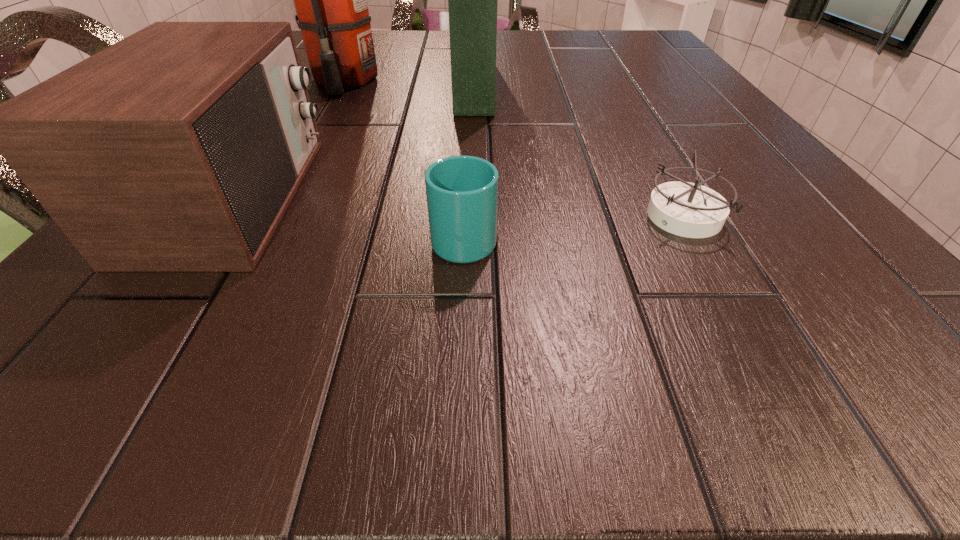
Where is `vacant point that satisfies the following two spatial constraints: 1. on the nozzle of the compass; 2. on the right side of the fire extinguisher`? The width and height of the screenshot is (960, 540). vacant point that satisfies the following two spatial constraints: 1. on the nozzle of the compass; 2. on the right side of the fire extinguisher is located at coordinates (263, 217).

This screenshot has width=960, height=540. I want to click on vacant position in the image that satisfies the following two spatial constraints: 1. on the handle side of the fourth tallest object; 2. on the front-facing side of the radio receiver, so click(466, 198).

Identify the location of vacant space that satisfies the following two spatial constraints: 1. on the back side of the compass; 2. on the front-facing side of the first-aid kit. (612, 85).

The height and width of the screenshot is (540, 960). I want to click on free location that satisfies the following two spatial constraints: 1. on the nozzle of the tallest object; 2. on the front-facing side of the radio receiver, so click(275, 198).

In order to click on free space that satisfies the following two spatial constraints: 1. on the front-facing side of the radio receiver; 2. on the handle side of the cup in this screenshot , I will do `click(207, 238)`.

Locate an element on the screen. Image resolution: width=960 pixels, height=540 pixels. blank area in the image that satisfies the following two spatial constraints: 1. on the front-facing side of the third shortest object; 2. on the handle side of the second shortest object is located at coordinates (207, 238).

Where is `vacant region that satisfies the following two spatial constraints: 1. on the front-facing side of the first-aid kit; 2. on the back side of the shortest object`? Image resolution: width=960 pixels, height=540 pixels. vacant region that satisfies the following two spatial constraints: 1. on the front-facing side of the first-aid kit; 2. on the back side of the shortest object is located at coordinates 471,217.

I want to click on vacant space that satisfies the following two spatial constraints: 1. on the handle side of the fourth tallest object; 2. on the left side of the rightmost object, so click(465, 217).

You are a GUI agent. You are given a task and a screenshot of the screen. Output one action in this format:
    pyautogui.click(x=<x>, y=<y>)
    Task: Click on the free spot that satisfies the following two spatial constraints: 1. on the nozzle of the tallest object; 2. on the right side of the compass
    
    Given the screenshot: What is the action you would take?
    pyautogui.click(x=263, y=217)